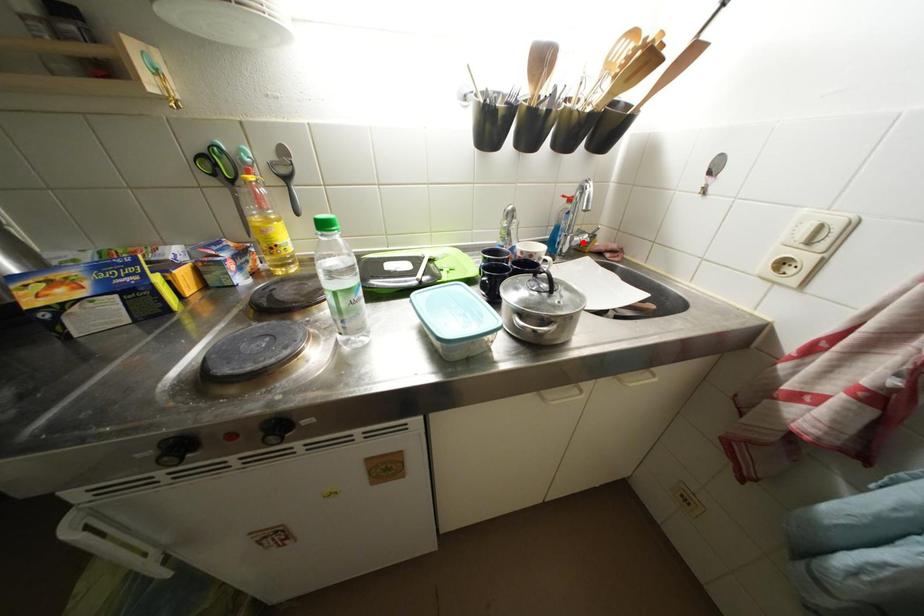
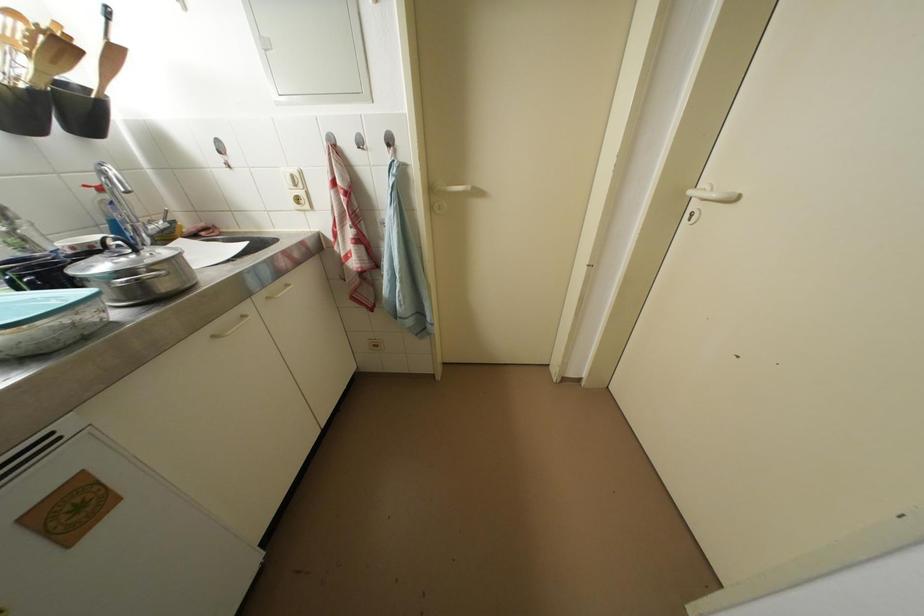
Locate, in the second image, the point that corresponds to the highlighted location in the first image.

(157, 231)